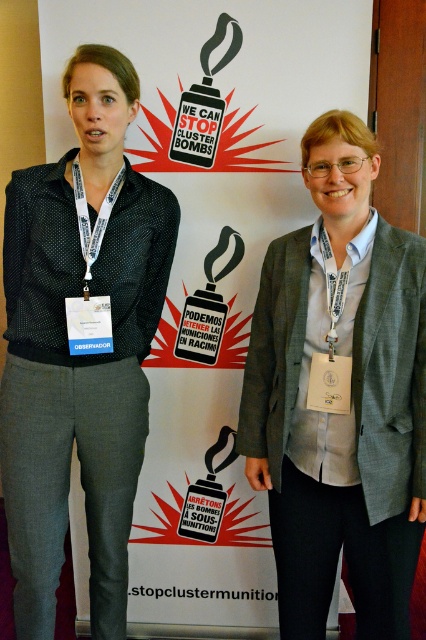
You are standing 5 feet away from the camera. You want to take a photo of the gray textured blazer at center without moving. Is the blazer within your camera range?

The gray textured blazer at center is 4.43 feet away from the camera. Since you are standing 5 feet away from the camera, the total distance between you and the blazer would be 5 feet plus 4.43 feet, which is 9.43 feet. Most cameras have a range of at least 10 feet, so it should be possible to take a photo of the gray textured blazer at center without moving.

You are a photographer setting up for a group photo. You need to ensure there is enough space between the gray textured blazer at center and the black dotted shirt at left to fit a small microphone stand that requires 1.5 feet of clearance. Based on the image, is the current distance sufficient?

The gray textured blazer at center is 18.80 inches away from the black dotted shirt at left. Since 18.80 inches is approximately 1.57 feet, which is slightly more than the required 1.5 feet of clearance, the current distance is sufficient to fit the microphone stand.

You are standing in front of the campaign backdrop. Where is the gray textured blazer at center located?

The gray textured blazer at center is located at point (x=339, y=394).